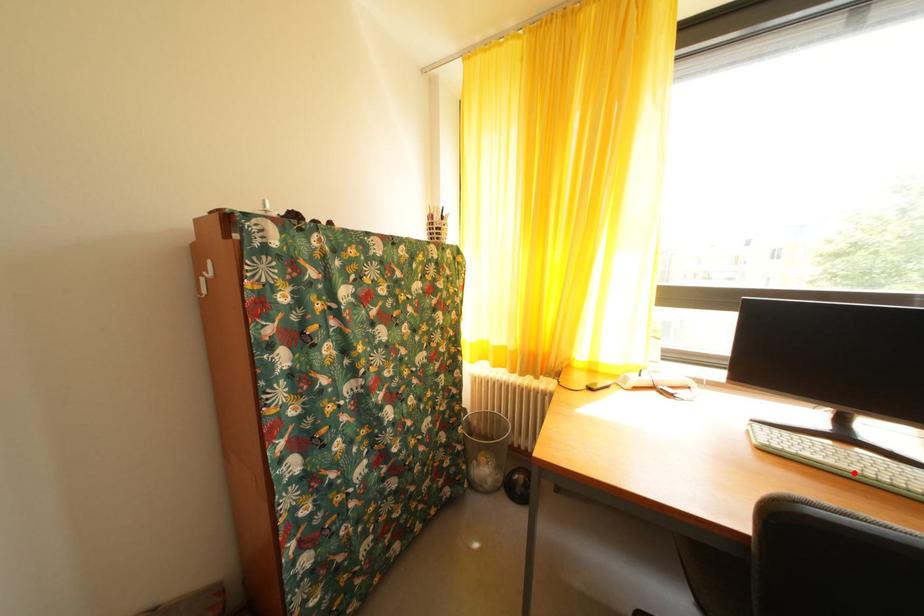
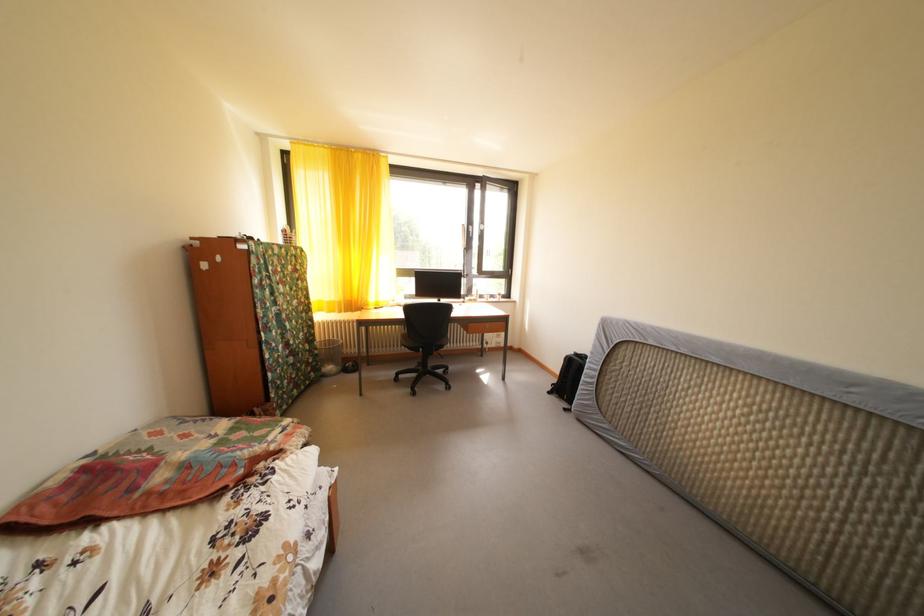
Question: I am providing you with two images of the same scene from different viewpoints. A red point is marked on the first image. At the location where the point appears in image 1, is it still visible in image 2?

Choices:
 (A) Yes
 (B) No

Answer: (B)